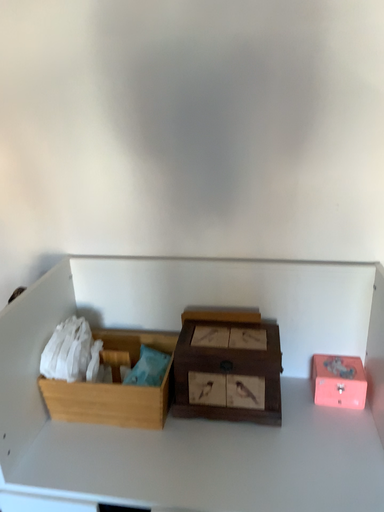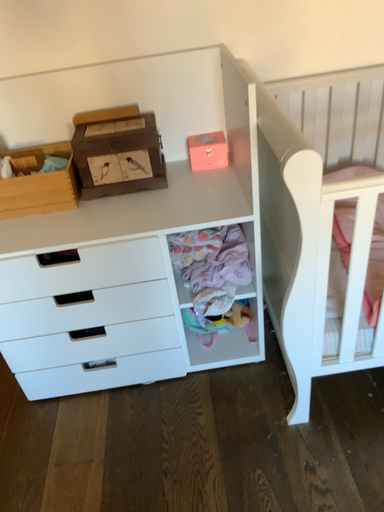
Question: How did the camera likely rotate when shooting the video?

Choices:
 (A) rotated downward
 (B) rotated upward

Answer: (A)